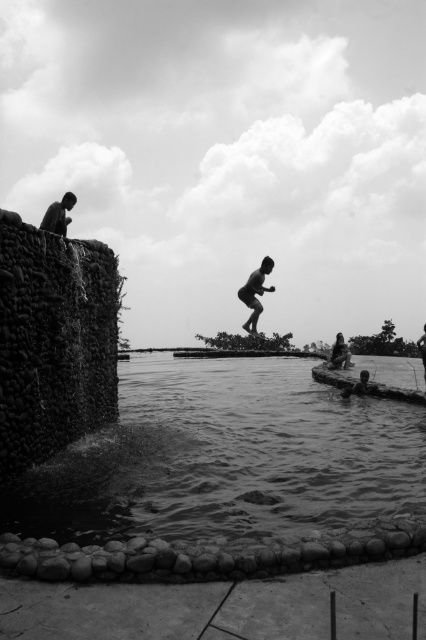
Question: Does dark skin human at upper left have a smaller size compared to smooth skin man at center?

Choices:
 (A) no
 (B) yes

Answer: (B)

Question: Does silhouette wooden skateboard at center come behind dark skin human at upper left?

Choices:
 (A) no
 (B) yes

Answer: (B)

Question: Which object is farther from the camera taking this photo?

Choices:
 (A) smooth skin man at center
 (B) smooth water at lower center
 (C) silhouette wooden skateboard at center

Answer: (A)

Question: Does smooth water at lower center appear over silhouette wooden skateboard at center?

Choices:
 (A) yes
 (B) no

Answer: (B)

Question: Estimate the real-world distances between objects in this image. Which object is farther from the smooth skin man at center?

Choices:
 (A) smooth water at lower center
 (B) silhouette wooden skateboard at center

Answer: (A)

Question: Which of these objects is positioned farthest from the smooth water at lower center?

Choices:
 (A) smooth skin man at center
 (B) dark skin human at upper left
 (C) silhouette wooden skateboard at center

Answer: (B)